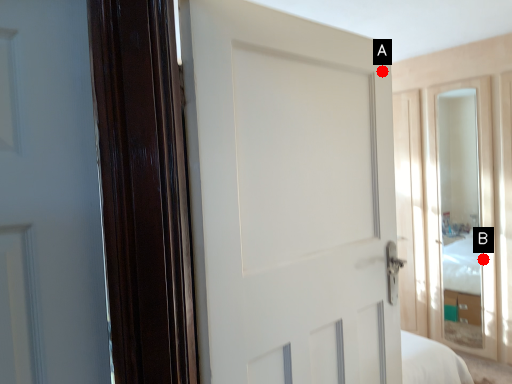
Question: Two points are circled on the image, labeled by A and B beside each circle. Which of the following is the farthest from the observer?

Choices:
 (A) A is further
 (B) B is further

Answer: (B)